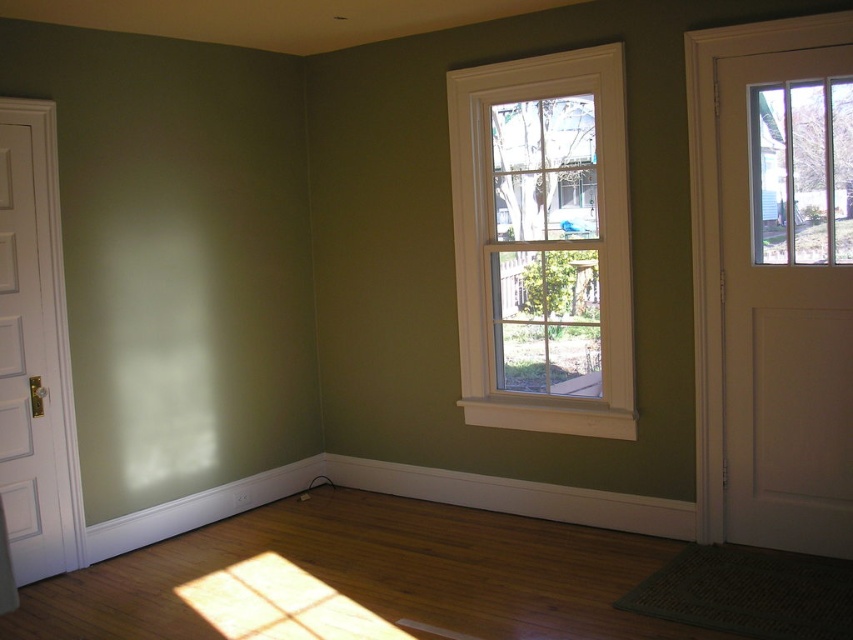
Does white wood window at center appear on the right side of white wood door at right?

No, white wood window at center is not to the right of white wood door at right.

Does point (598, 93) lie in front of point (849, 40)?

No.

The height and width of the screenshot is (640, 853). What are the coordinates of `white wood window at center` in the screenshot? It's located at (543, 243).

Can you confirm if white wood window at center is smaller than white wood door at left?

Actually, white wood window at center might be larger than white wood door at left.

Can you confirm if white wood window at center is taller than white wood door at left?

No.

Which is in front, point (483, 212) or point (61, 326)?

Point (61, 326) is in front.

You are a GUI agent. You are given a task and a screenshot of the screen. Output one action in this format:
    pyautogui.click(x=<x>, y=<y>)
    Task: Click on the white wood window at center
    This screenshot has height=640, width=853.
    Given the screenshot: What is the action you would take?
    pyautogui.click(x=543, y=243)

Does white wood door at left have a smaller size compared to white wood door at right?

Correct, white wood door at left occupies less space than white wood door at right.

Who is more forward, (x=27, y=515) or (x=700, y=138)?

Point (x=700, y=138) is in front.

This screenshot has width=853, height=640. Identify the location of white wood door at left. click(35, 353).